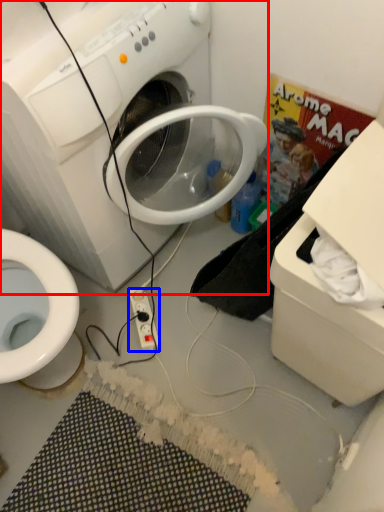
Question: Which of the following is the farthest to the observer, washing machine (highlighted by a red box) or power outlet (highlighted by a blue box)?

Choices:
 (A) washing machine
 (B) power outlet

Answer: (B)